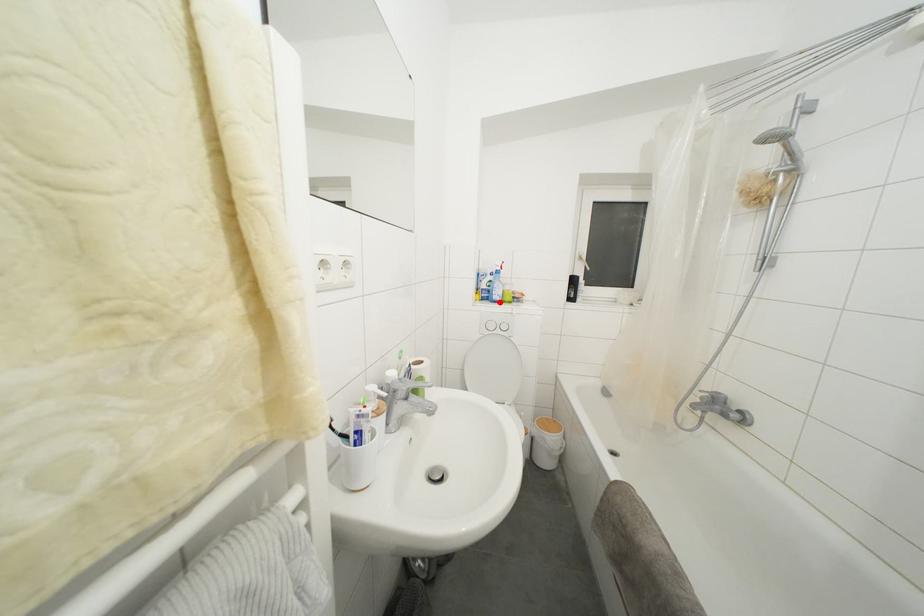
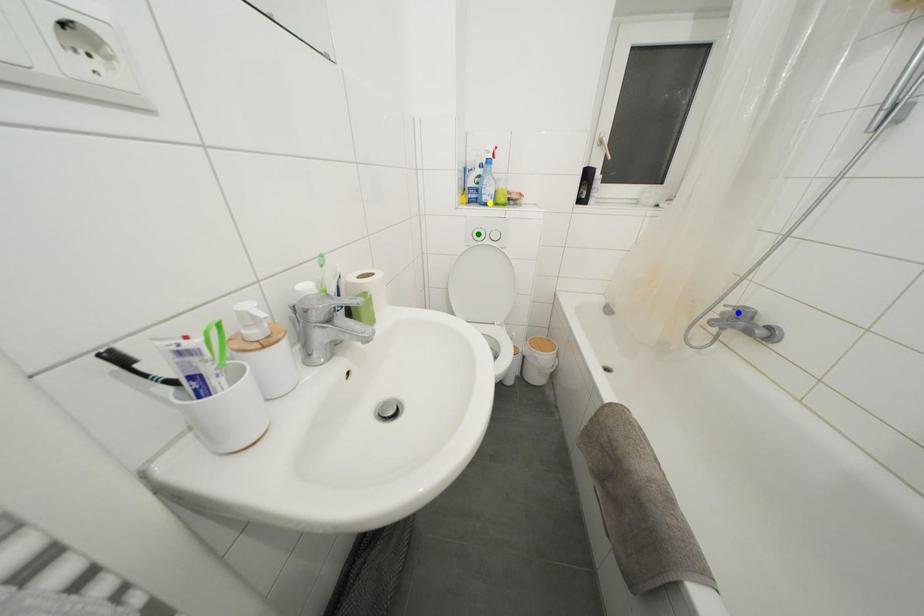
Question: I am providing you with two images of the same scene from different viewpoints. A red point is marked on the first image. You are given multiple points on the second image. Which mark in image 2 goes with the point in image 1?

Choices:
 (A) yellow point
 (B) blue point
 (C) green point

Answer: (A)